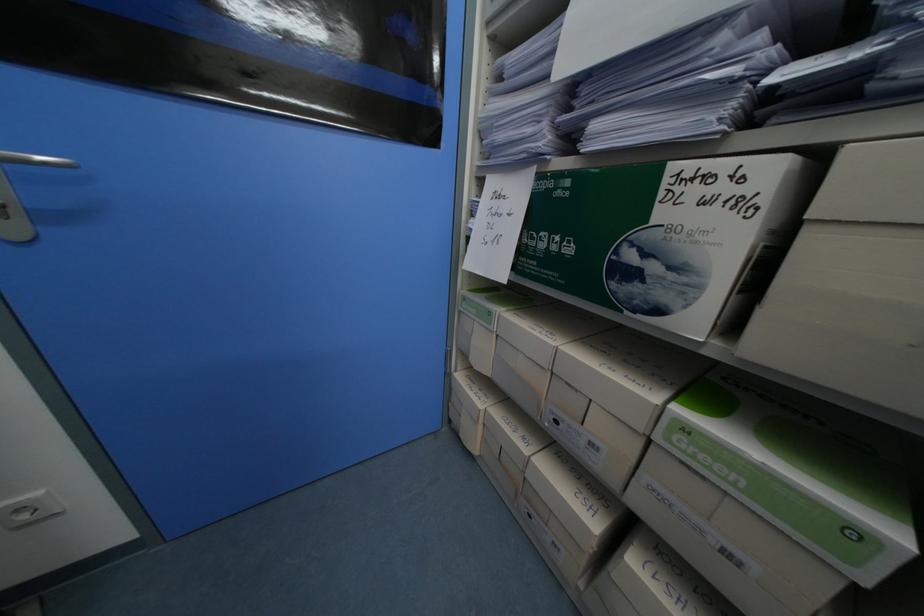
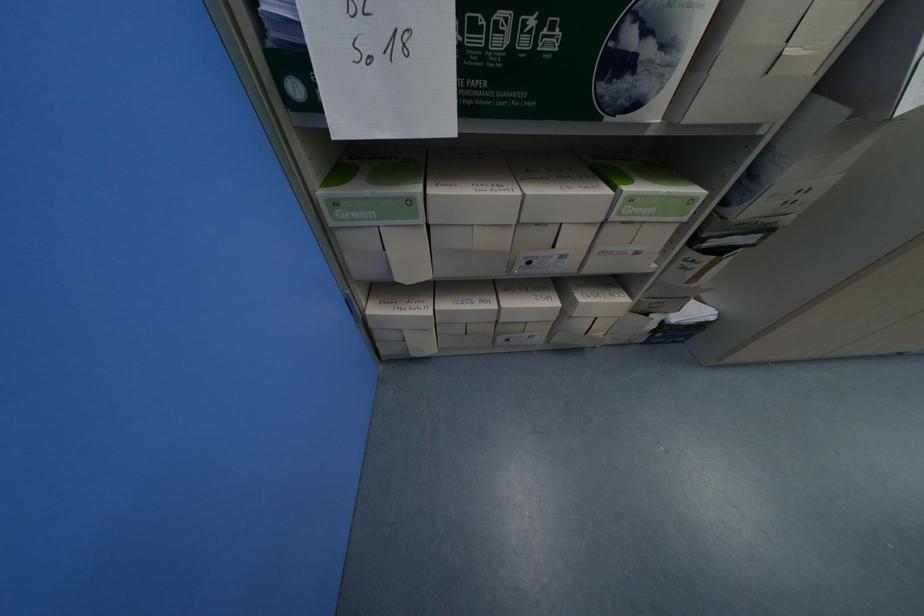
Find the pixel in the second image that matches point 525,440 in the first image.

(489, 306)